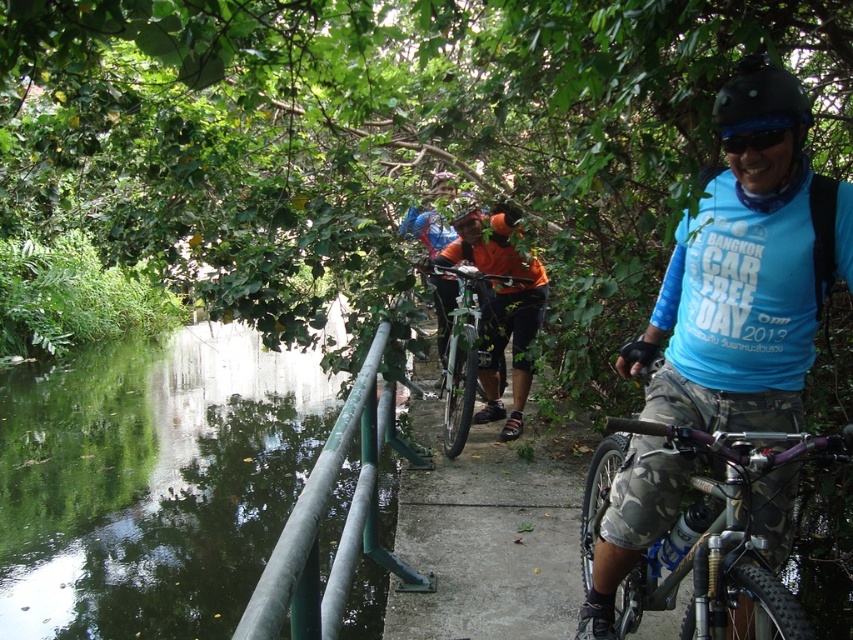
You are a photographer taking a picture of the blue matte shirt at center and the matte black helmet at center. Which object should you focus on first if you want to capture both in sharp focus?

The blue matte shirt at center is below the matte black helmet at center, so you should focus on the matte black helmet at center first to ensure both are in sharp focus.

You are a cyclist participating in the event and need to place a small marker between the green smooth water at lower left and the matte black helmet at center to mark the halfway point of the path. How far apart should you place the marker from each object?

The green smooth water at lower left and matte black helmet at center are 5.23 meters apart. To place the marker exactly halfway, it should be placed 2.615 meters from each object.